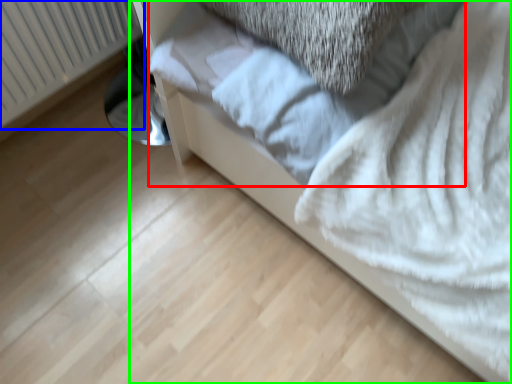
Question: Which object is positioned closest to sheet (highlighted by a red box)? Select from radiator (highlighted by a blue box) and furniture (highlighted by a green box).

Choices:
 (A) radiator
 (B) furniture

Answer: (B)